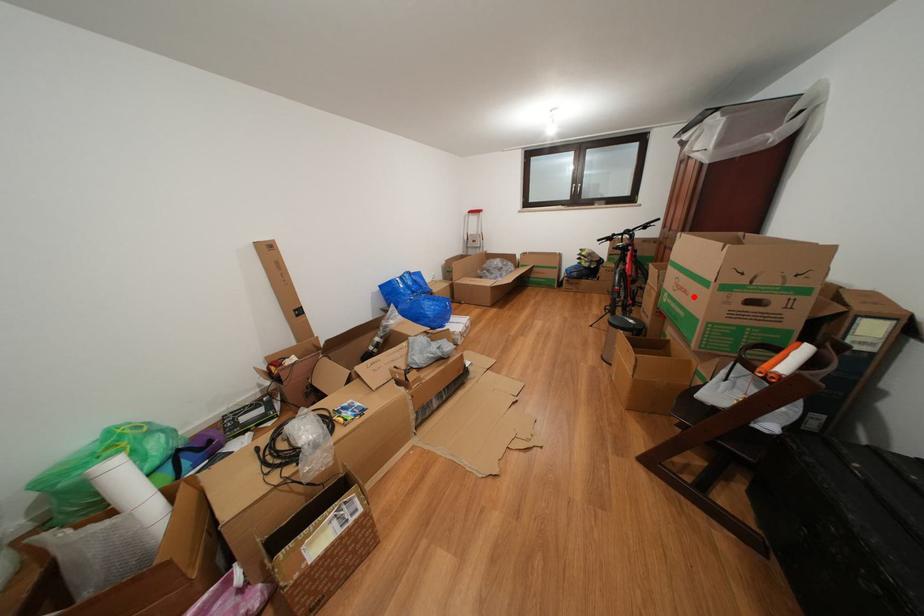
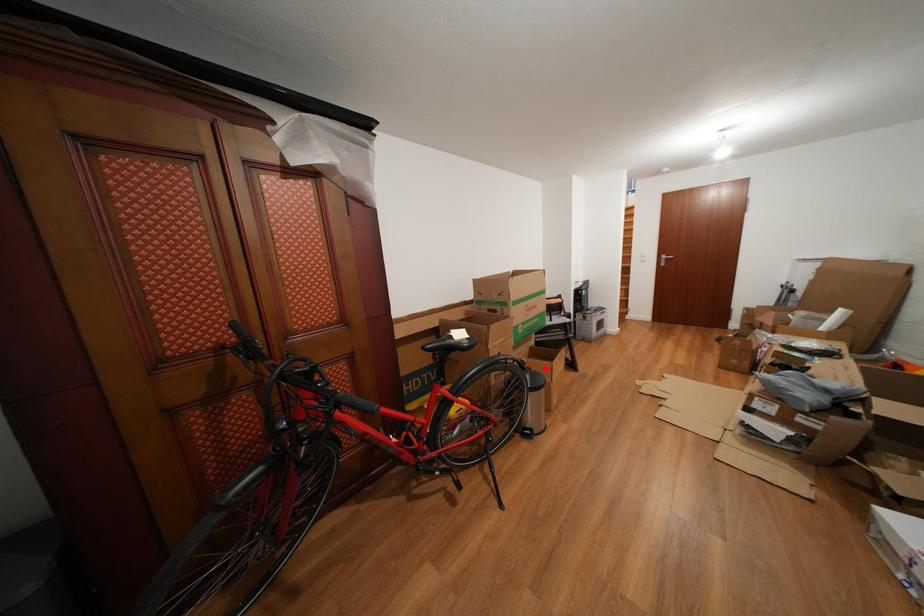
I am providing you with two images of the same scene from different viewpoints. A red point is marked on the first image and another point is marked on the second image. Is the red point in image1 aligned with the point shown in image2?

No